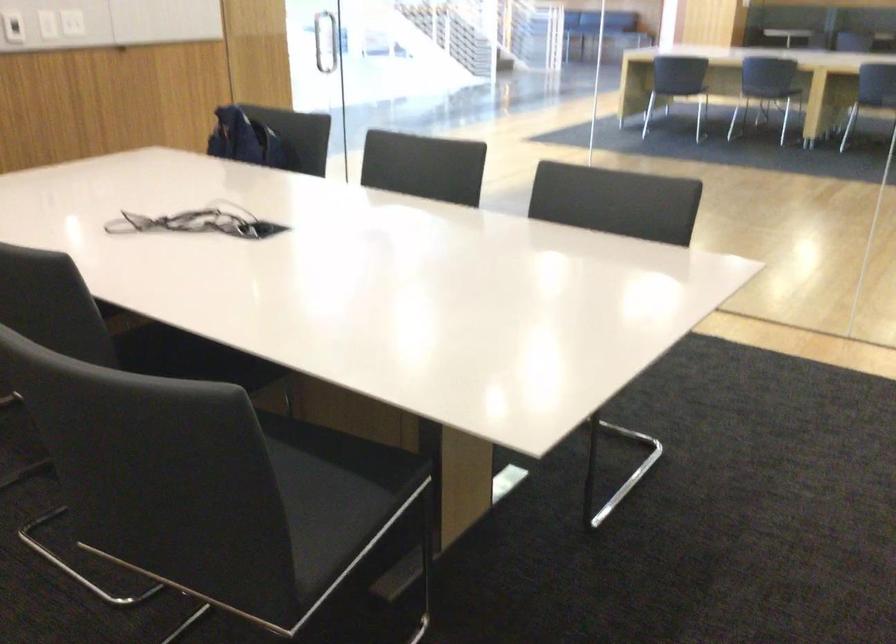
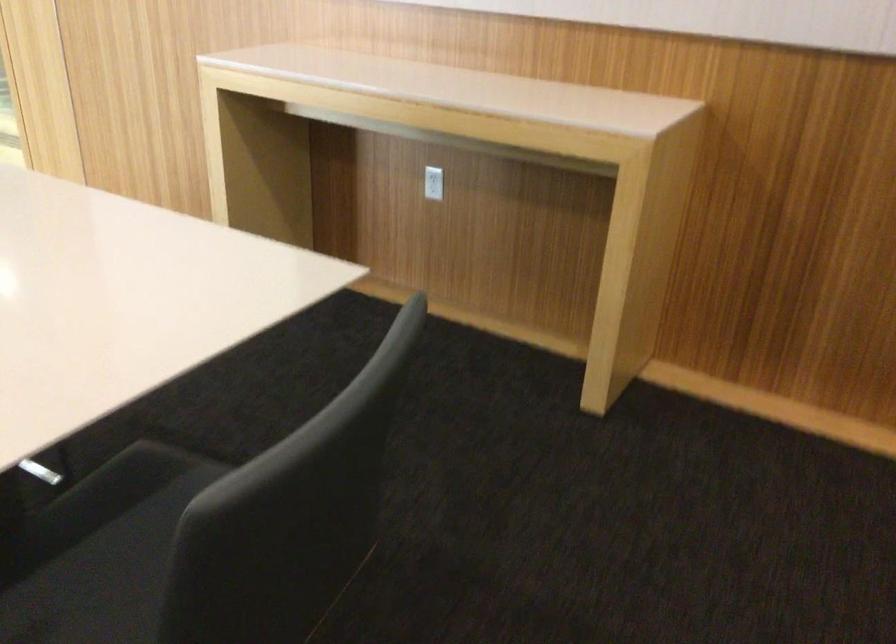
The point at (x=287, y=462) is marked in the first image. Where is the corresponding point in the second image?

(101, 551)